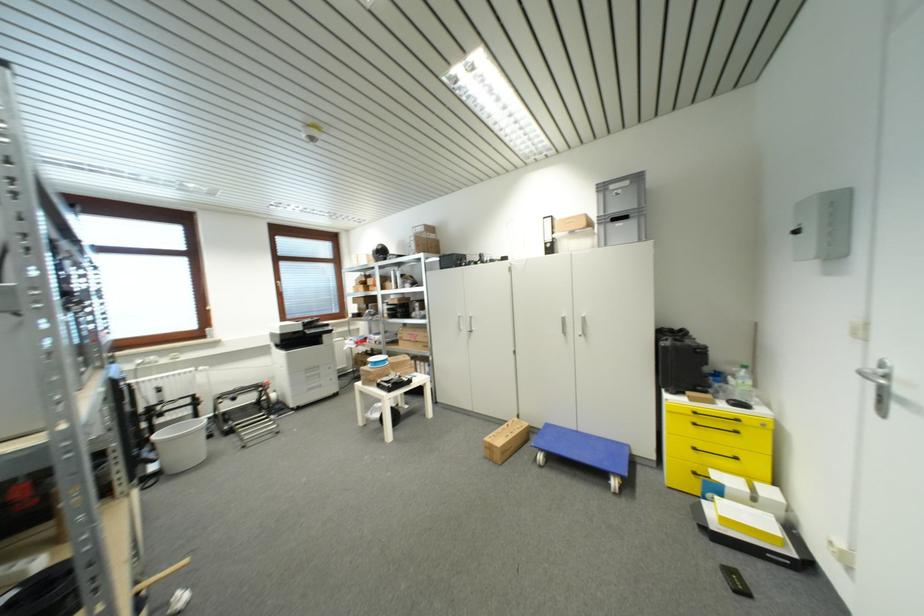
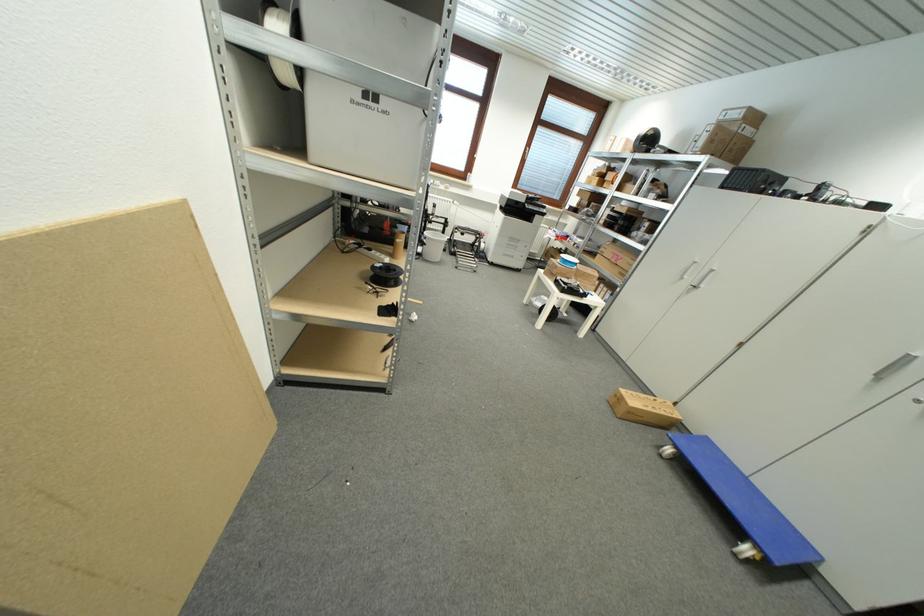
Where in the second image is the point corresponding to (x=552, y=427) from the first image?

(711, 440)